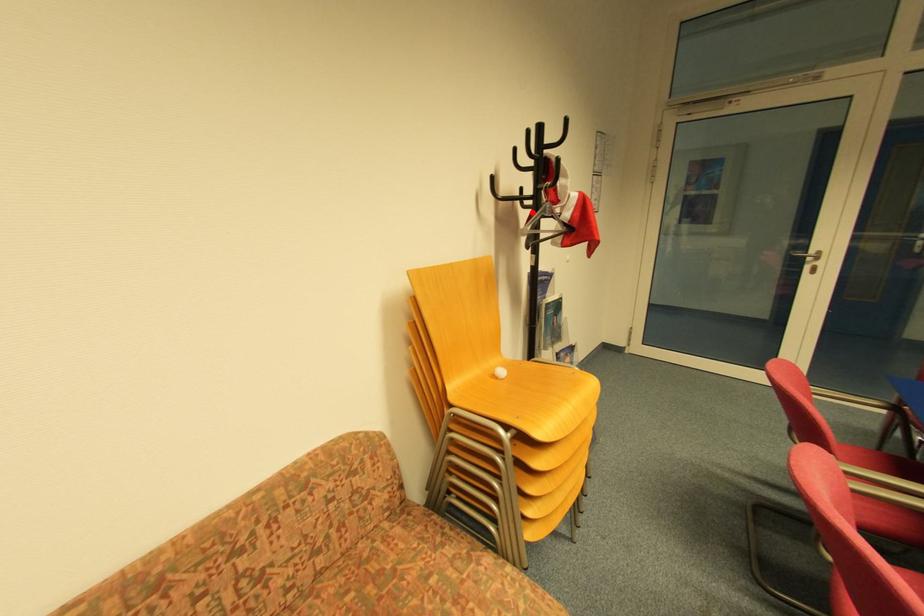
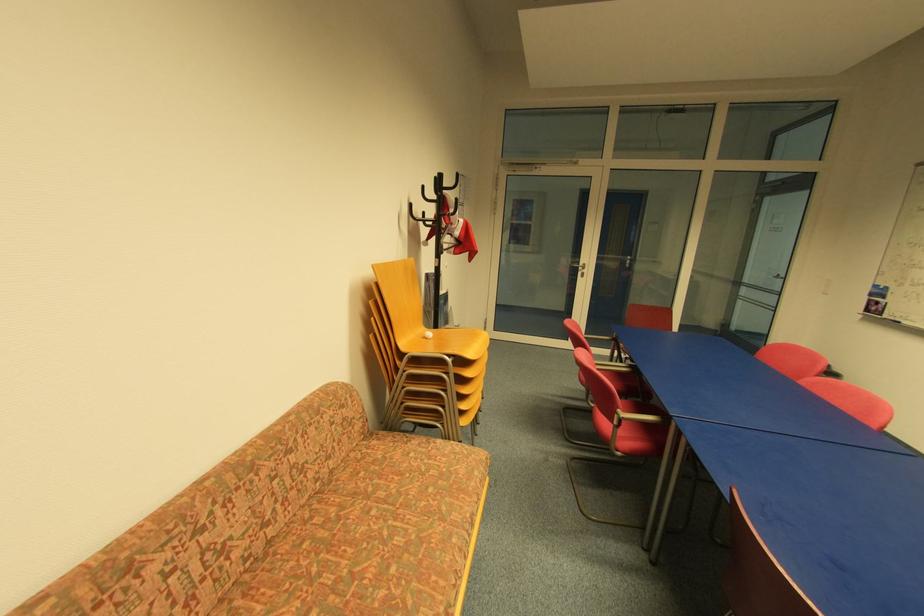
Find the pixel in the second image that matches the highlighted location in the first image.

(434, 230)